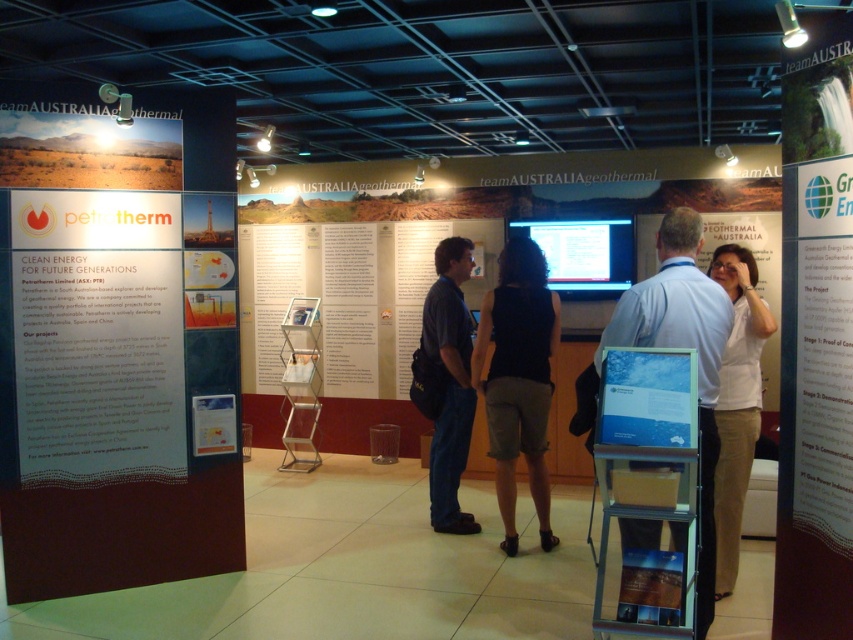
You are an attendee at the conference and you want to read the information on the white paper at center and the black fabric dress at center. Which one has a larger width?

The white paper at center has a larger width than the black fabric dress at center.

You are a conference attendee standing in the middle of the exhibition space. You see a white paper at center and a black fabric dress at center. Which object is located to the right of the other?

The white paper at center is positioned on the right side of black fabric dress at center, so the white paper at center is to the right of the black fabric dress at center.

You are a conference attendee standing at the entrance of the Petrotherm booth. You notice the dark blue shirt at center and the blue glossy poster at center. Which object is larger in size?

The dark blue shirt at center is bigger than the blue glossy poster at center.